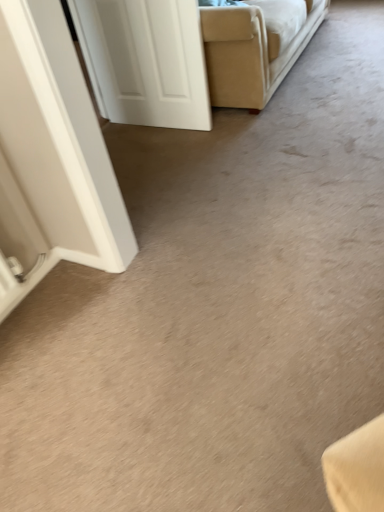
What is the approximate height of white matte door at upper left?

white matte door at upper left is 32.49 inches in height.

The height and width of the screenshot is (512, 384). What do you see at coordinates (145, 61) in the screenshot? I see `white matte door at upper left` at bounding box center [145, 61].

The width and height of the screenshot is (384, 512). In order to click on white matte door at upper left in this screenshot , I will do `click(145, 61)`.

Locate an element on the screen. The height and width of the screenshot is (512, 384). white matte door at upper left is located at coordinates (145, 61).